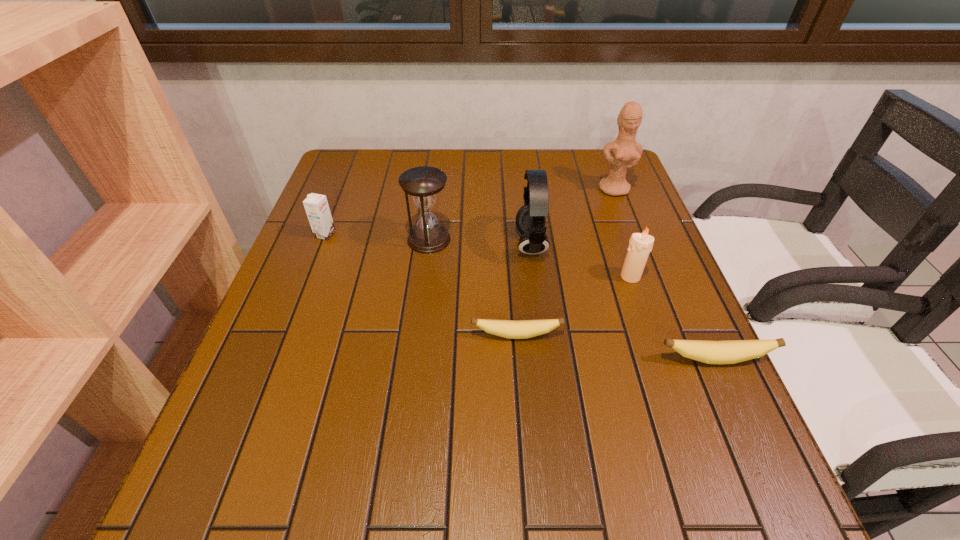
Locate an element on the screen. This screenshot has height=540, width=960. vacant area at the right edge of the desktop is located at coordinates (664, 296).

Where is `vacant area at the far left corner of the desktop`? This screenshot has width=960, height=540. vacant area at the far left corner of the desktop is located at coordinates (372, 179).

The width and height of the screenshot is (960, 540). Identify the location of free space at the far right corner. (595, 185).

You are a GUI agent. You are given a task and a screenshot of the screen. Output one action in this format:
    pyautogui.click(x=<x>, y=<y>)
    Task: Click on the vacant space that's between the earphone and the fourth shortest object
    
    Given the screenshot: What is the action you would take?
    [581, 260]

Identify the location of free space that is in between the third nearest object and the second nearest object. (573, 306).

Where is `free point between the chocolate milk and the fourth tallest object`? This screenshot has height=540, width=960. free point between the chocolate milk and the fourth tallest object is located at coordinates (478, 255).

Identify the location of unoccupied area between the second shortest object and the candle. (672, 318).

You are a GUI agent. You are given a task and a screenshot of the screen. Output one action in this format:
    pyautogui.click(x=<x>, y=<y>)
    Task: Click on the free point between the second shortest object and the left banana
    The height and width of the screenshot is (540, 960).
    Given the screenshot: What is the action you would take?
    click(615, 347)

I want to click on vacant space that's between the second object from left to right and the taller banana, so click(x=572, y=299).

Locate an element on the screen. blank region between the nearest object and the earphone is located at coordinates (623, 302).